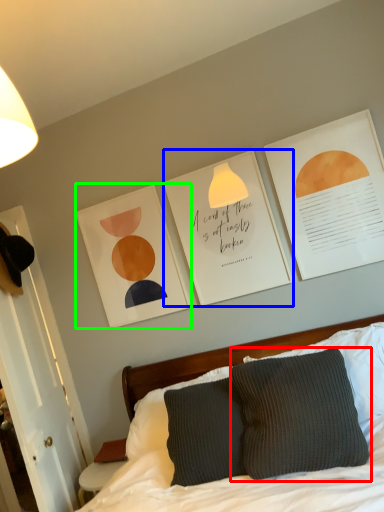
Question: Estimate the real-world distances between objects in this image. Which object is farther from pillow (highlighted by a red box), postcard (highlighted by a blue box) or picture frame (highlighted by a green box)?

Choices:
 (A) postcard
 (B) picture frame

Answer: (B)